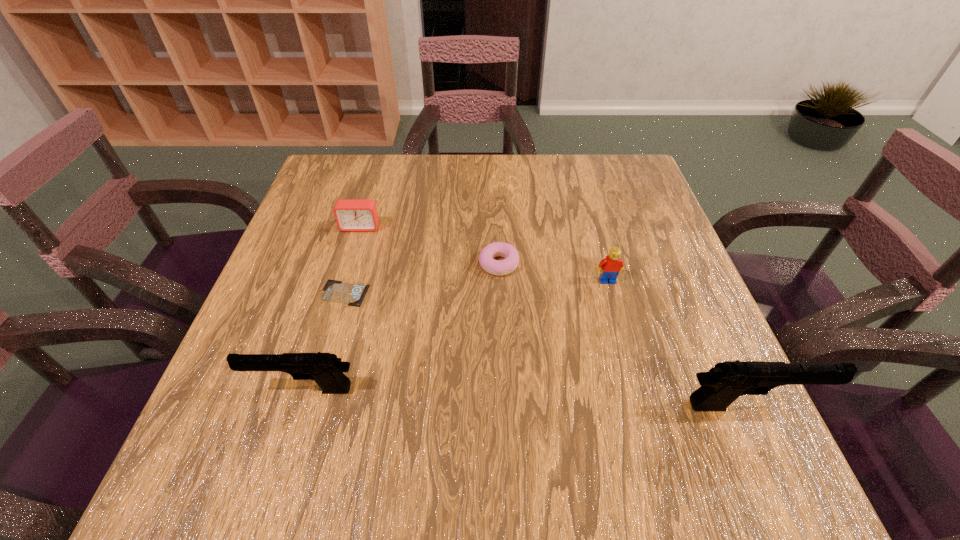
If we want them evenly spaced by inserting an extra pistol among them, please locate a free spot for this new pistol. Please provide its 2D coordinates. Your answer should be formatted as a tuple, i.e. [(x, y)], where the tuple contains the x and y coordinates of a point satisfying the conditions above.

[(522, 397)]